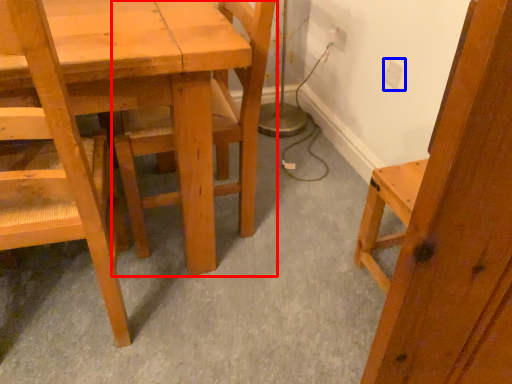
Question: Which point is further to the camera, chair (highlighted by a red box) or electric outlet (highlighted by a blue box)?

Choices:
 (A) chair
 (B) electric outlet

Answer: (B)